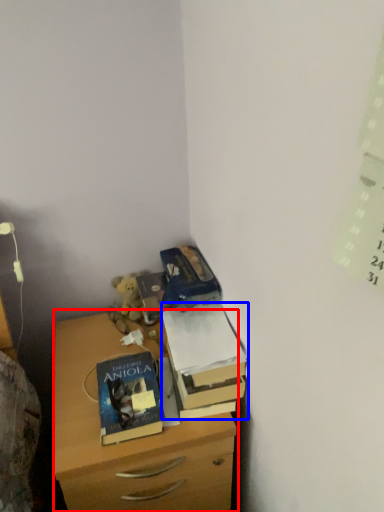
Question: Among these objects, which one is nearest to the camera, chest of drawers (highlighted by a red box) or box (highlighted by a blue box)?

Choices:
 (A) chest of drawers
 (B) box

Answer: (A)